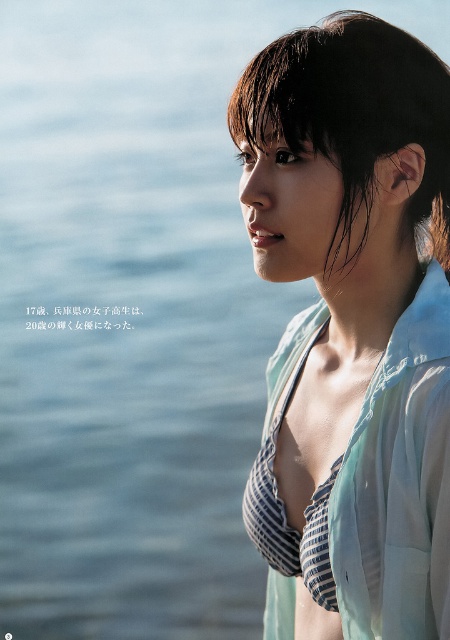
Based on the photo, who is higher up, wet dark brown hair at upper center or dark brown hair at upper right?

wet dark brown hair at upper center is above.

Is wet dark brown hair at upper center thinner than dark brown hair at upper right?

In fact, wet dark brown hair at upper center might be wider than dark brown hair at upper right.

Who is more forward, (405, 58) or (430, 227)?

Positioned in front is point (405, 58).

Find the location of a particular element. This screenshot has width=450, height=640. wet dark brown hair at upper center is located at coordinates (350, 108).

Is light blue striped bikini top at center to the left of wet dark brown hair at upper center from the viewer's perspective?

In fact, light blue striped bikini top at center is to the right of wet dark brown hair at upper center.

Measure the distance between light blue striped bikini top at center and wet dark brown hair at upper center.

They are 4.35 inches apart.

Which is in front, point (387, 333) or point (230, 100)?

Point (387, 333) is in front.

Locate an element on the screen. This screenshot has width=450, height=640. light blue striped bikini top at center is located at coordinates (351, 330).

Between point (370, 611) and point (441, 260), which one is positioned behind?

The point (441, 260) is behind.

Consider the image. Between light blue striped bikini top at center and dark brown hair at upper right, which one appears on the left side from the viewer's perspective?

From the viewer's perspective, light blue striped bikini top at center appears more on the left side.

You are a GUI agent. You are given a task and a screenshot of the screen. Output one action in this format:
    pyautogui.click(x=<x>, y=<y>)
    Task: Click on the light blue striped bikini top at center
    Image resolution: width=450 pixels, height=640 pixels.
    Given the screenshot: What is the action you would take?
    pyautogui.click(x=351, y=330)

The height and width of the screenshot is (640, 450). I want to click on light blue striped bikini top at center, so click(351, 330).